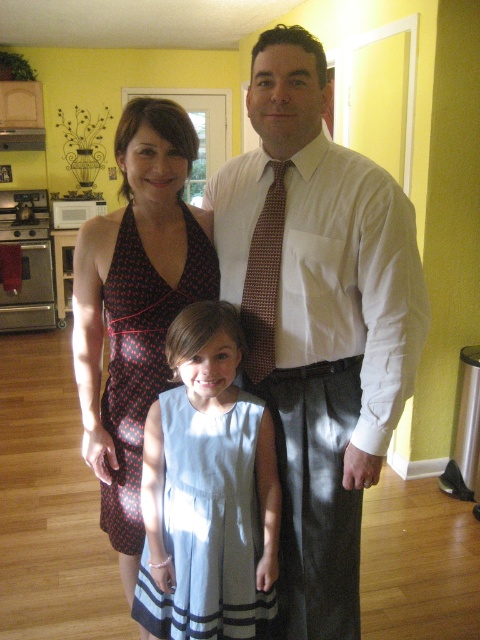
You are standing in the kitchen and want to take a photo of the two points marked in the scene. Which point, point [288,138] or point [108,276], will appear larger in the photo?

Point [288,138] is closer to the camera than point [108,276], so it will appear larger in the photo.

You are helping a customer at a clothing store who wants to buy a dress that is the right size for their child. The customer shows you the image of the family and points to the light blue cotton dress at center and the light blue fabric dress at center. They ask which one is more likely to fit a child. Based on the image, which dress should you recommend?

The light blue cotton dress at center is bigger than the light blue fabric dress at center, so the light blue fabric dress at center is more likely to fit a child.

You are a photographer setting up for a family photo. You need to position a small stool so that it is between the white textured shirt at center and the light blue fabric dress at center. Which direction should you place the stool relative to the taller object?

The white textured shirt at center is taller than the light blue fabric dress at center. To place the stool between them, position it towards the shorter light blue fabric dress at center side of the white textured shirt at center.